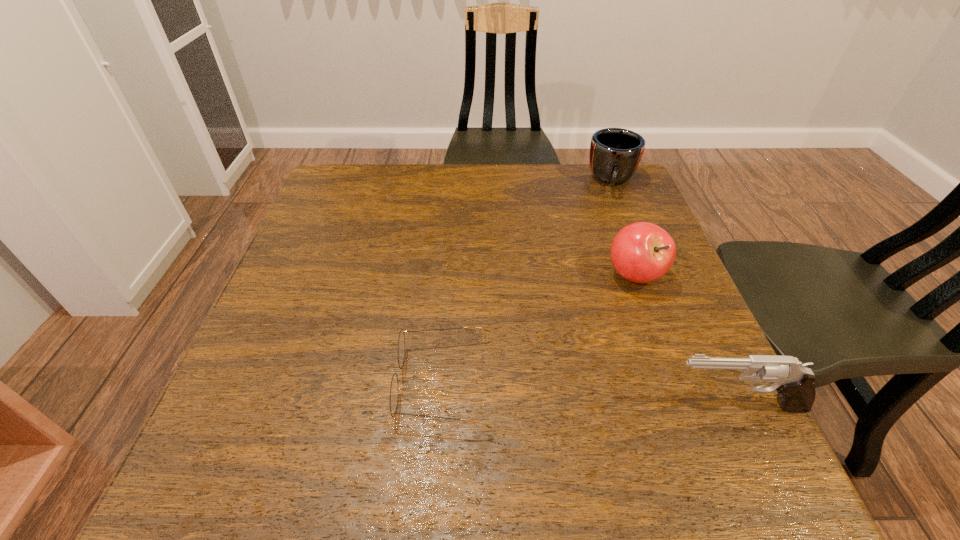
Locate an element on the screen. The width and height of the screenshot is (960, 540). gun that is at the right edge is located at coordinates (793, 381).

At what (x,y) coordinates should I click in order to perform the action: click on apple present at the right edge. Please return your answer as a coordinate pair (x, y). The width and height of the screenshot is (960, 540). Looking at the image, I should click on (641, 252).

This screenshot has width=960, height=540. What are the coordinates of `mug that is positioned at the right edge` in the screenshot? It's located at (615, 153).

The width and height of the screenshot is (960, 540). What are the coordinates of `object that is positioned at the far right corner` in the screenshot? It's located at (615, 153).

Image resolution: width=960 pixels, height=540 pixels. I want to click on object situated at the near right corner, so [x=793, y=381].

You are a GUI agent. You are given a task and a screenshot of the screen. Output one action in this format:
    pyautogui.click(x=<x>, y=<y>)
    Task: Click on the free space at the far edge of the desktop
    This screenshot has height=540, width=960.
    Given the screenshot: What is the action you would take?
    pyautogui.click(x=513, y=165)

In the image, there is a desktop. Identify the location of free space at the near edge. (388, 414).

Identify the location of vacant space at the left edge of the desktop. (330, 273).

Identify the location of unoccupied position between the second farthest object and the spectacles. The image size is (960, 540). (539, 328).

Where is `vacant area that lies between the gun and the apple`? The height and width of the screenshot is (540, 960). vacant area that lies between the gun and the apple is located at coordinates (685, 340).